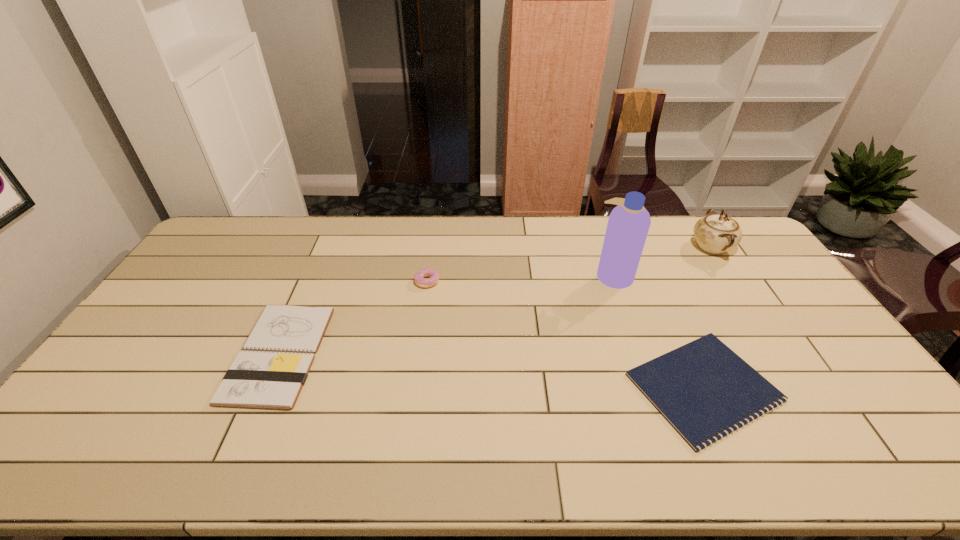
The height and width of the screenshot is (540, 960). I want to click on vacant region at the far left corner of the desktop, so click(255, 227).

Find the location of a particular element. This screenshot has width=960, height=540. vacant area between the third shortest object and the fourth shortest object is located at coordinates (569, 264).

Locate an element on the screen. This screenshot has width=960, height=540. vacant space in between the right notepad and the second object from left to right is located at coordinates (565, 334).

Identify the location of empty location between the third tallest object and the fourth tallest object. The image size is (960, 540). (353, 318).

Locate an element on the screen. empty space between the shortest object and the taller notepad is located at coordinates (492, 370).

The width and height of the screenshot is (960, 540). I want to click on free space between the doughnut and the leftmost object, so click(353, 318).

You are a GUI agent. You are given a task and a screenshot of the screen. Output one action in this format:
    pyautogui.click(x=<x>, y=<y>)
    Task: Click on the free point between the chinaware and the shampoo
    
    Given the screenshot: What is the action you would take?
    pyautogui.click(x=662, y=261)

Locate an element on the screen. This screenshot has width=960, height=540. free spot between the left notepad and the second object from left to right is located at coordinates (353, 318).

The height and width of the screenshot is (540, 960). Identify the location of free space between the right notepad and the third tallest object. (565, 334).

Locate an element on the screen. Image resolution: width=960 pixels, height=540 pixels. vacant area that lies between the taller notepad and the shorter notepad is located at coordinates (492, 370).